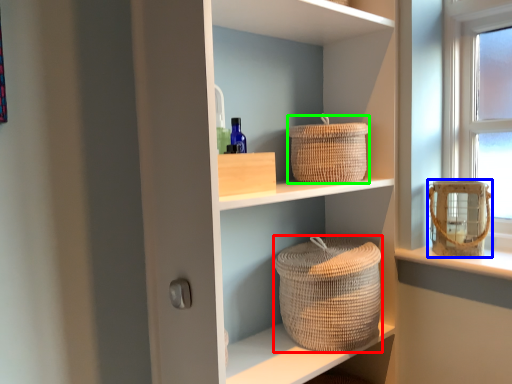
Question: Which object is positioned farthest from basket container (highlighted by a red box)? Select from basket container (highlighted by a blue box) and basket (highlighted by a green box).

Choices:
 (A) basket container
 (B) basket

Answer: (A)